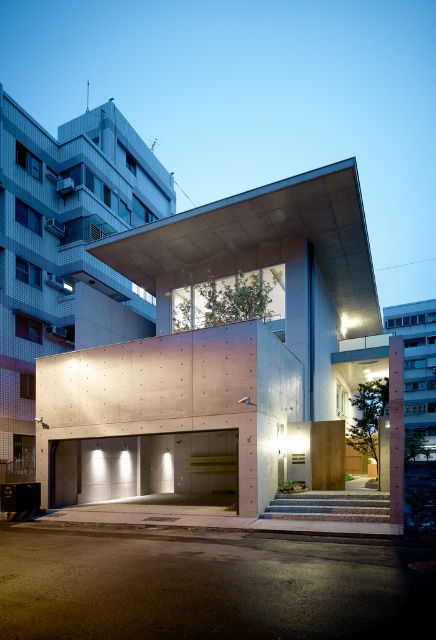
Is concrete parking garage at center positioned at the back of smooth concrete at lower center?

Yes, concrete parking garage at center is further from the viewer.

Does point (237, 512) lie in front of point (128, 620)?

No, it is behind (128, 620).

Is point (303, 317) positioned in front of point (198, 557)?

No, (303, 317) is further to viewer.

Image resolution: width=436 pixels, height=640 pixels. Identify the location of concrete parking garage at center. (228, 356).